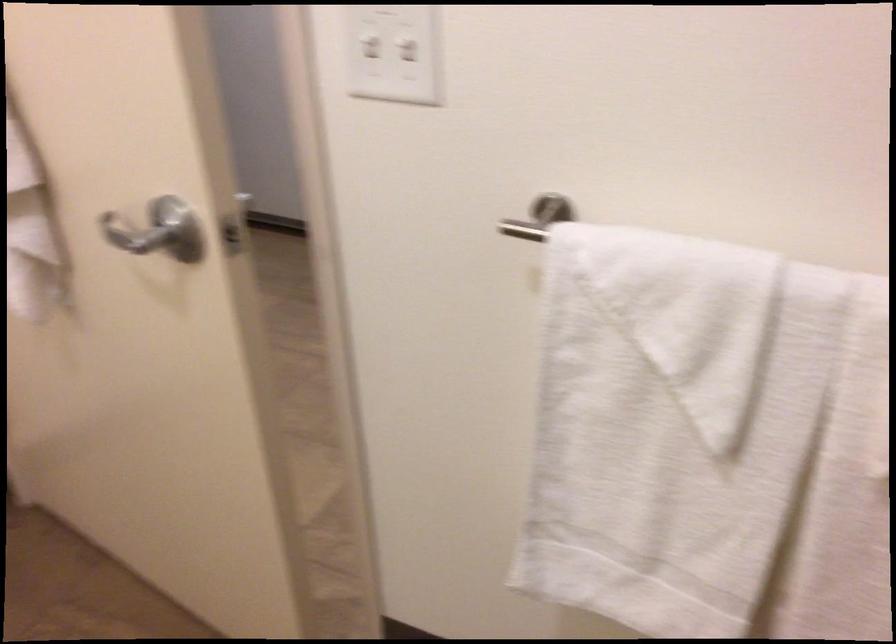
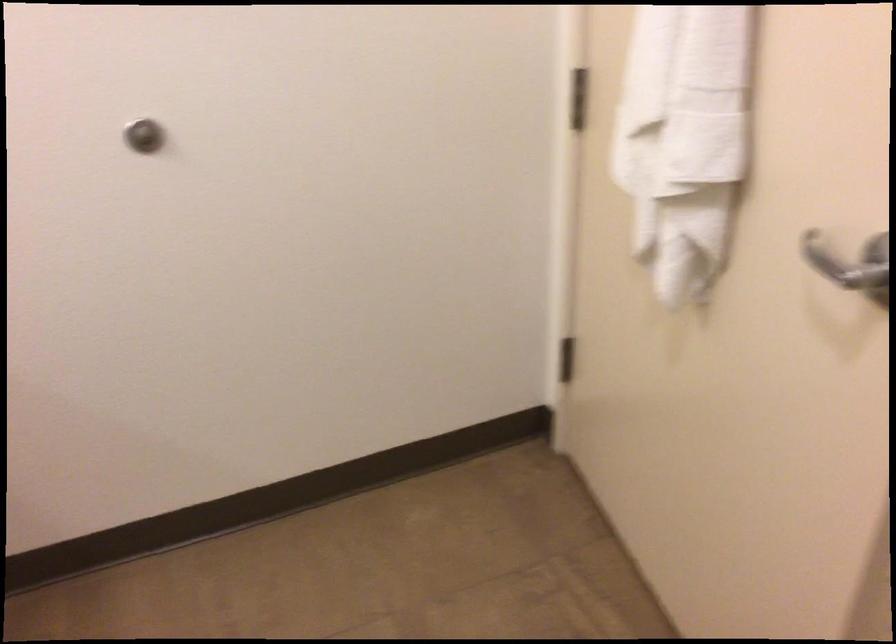
Question: The camera is either moving clockwise (left) or counter-clockwise (right) around the object. The first image is from the beginning of the video and the second image is from the end. Is the camera moving left or right when shooting the video?

Choices:
 (A) Left
 (B) Right

Answer: (B)